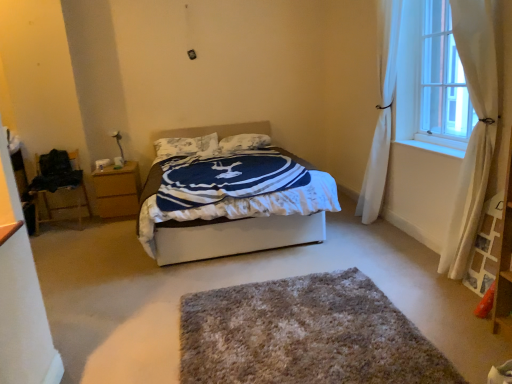
Question: In terms of height, does textured white pillow at center, marked as the 2th pillow in a right-to-left arrangement, look taller or shorter compared to wooden chair at left?

Choices:
 (A) tall
 (B) short

Answer: (B)

Question: In terms of size, does textured white pillow at center, marked as the 2th pillow in a right-to-left arrangement, appear bigger or smaller than wooden chair at left?

Choices:
 (A) small
 (B) big

Answer: (A)

Question: Which of these objects is positioned closest to the textured white pillow at center, marked as the 2th pillow in a right-to-left arrangement?

Choices:
 (A) white soft bed at center
 (B) white sheer curtain at right, the first curtain positioned from the front
 (C) white sheer curtain at upper right
 (D) white soft pillow at center, marked as the 2th pillow in a left-to-right arrangement
 (E) wooden chair at left

Answer: (D)

Question: Estimate the real-world distances between objects in this image. Which object is farther from the white sheer curtain at right, the first curtain positioned from the front?

Choices:
 (A) textured white pillow at center, which is the first pillow in left-to-right order
 (B) wooden nightstand at left
 (C) white sheer curtain at right, the second curtain viewed from the front
 (D) wooden chair at left
 (E) shaggy gray rug at center

Answer: (D)